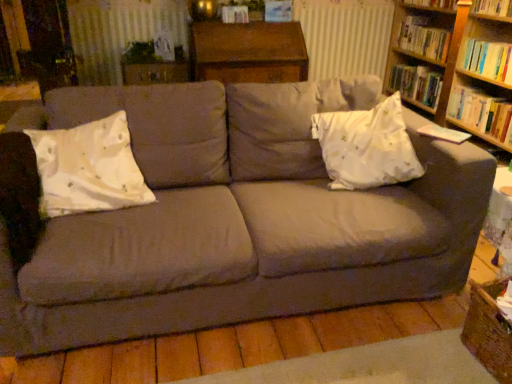
Question: Can you confirm if hardcover book at upper right, which is the 3th book in top-to-bottom order, is shorter than hardcover book at upper right, the 2th book from the top?

Choices:
 (A) no
 (B) yes

Answer: (B)

Question: Is hardcover book at upper right, marked as the 3th book in a bottom-to-top arrangement, turned away from hardcover book at upper right, positioned as the 4th book in bottom-to-top order?

Choices:
 (A) yes
 (B) no

Answer: (B)

Question: From a real-world perspective, is hardcover book at upper right, marked as the 3th book in a bottom-to-top arrangement, below hardcover book at upper right, positioned as the 4th book in bottom-to-top order?

Choices:
 (A) yes
 (B) no

Answer: (A)

Question: Considering the relative positions of hardcover book at upper right, which is the 3th book in top-to-bottom order, and hardcover book at upper right, the 2th book from the top, in the image provided, is hardcover book at upper right, which is the 3th book in top-to-bottom order, behind hardcover book at upper right, the 2th book from the top,?

Choices:
 (A) no
 (B) yes

Answer: (B)

Question: Is hardcover book at upper right, which is the 3th book in top-to-bottom order, closer to camera compared to hardcover book at upper right, the 2th book from the top?

Choices:
 (A) yes
 (B) no

Answer: (B)

Question: Is hardcover book at upper right, marked as the 3th book in a bottom-to-top arrangement, placed right next to hardcover book at upper right, the 2th book from the top?

Choices:
 (A) yes
 (B) no

Answer: (B)

Question: From the image's perspective, is hardcover book at right, acting as the 5th book starting from the top, located beneath hardcover book at upper center?

Choices:
 (A) yes
 (B) no

Answer: (A)

Question: Is hardcover book at right, acting as the 5th book starting from the top, aimed at hardcover book at upper center?

Choices:
 (A) no
 (B) yes

Answer: (A)

Question: From a real-world perspective, is hardcover book at right, the first book positioned from the bottom, beneath hardcover book at upper center?

Choices:
 (A) yes
 (B) no

Answer: (A)

Question: Are hardcover book at right, the first book positioned from the bottom, and hardcover book at upper center located far from each other?

Choices:
 (A) yes
 (B) no

Answer: (A)

Question: Considering the relative sizes of hardcover book at right, the first book positioned from the bottom, and hardcover book at upper center in the image provided, is hardcover book at right, the first book positioned from the bottom, wider than hardcover book at upper center?

Choices:
 (A) yes
 (B) no

Answer: (A)

Question: Considering the relative sizes of hardcover book at right, the first book positioned from the bottom, and hardcover book at upper center in the image provided, is hardcover book at right, the first book positioned from the bottom, smaller than hardcover book at upper center?

Choices:
 (A) no
 (B) yes

Answer: (A)

Question: Does hardcover book at right, acting as the 5th book starting from the top, have a smaller size compared to white satin pillow at right, the 2th throw pillow viewed from the left?

Choices:
 (A) no
 (B) yes

Answer: (B)